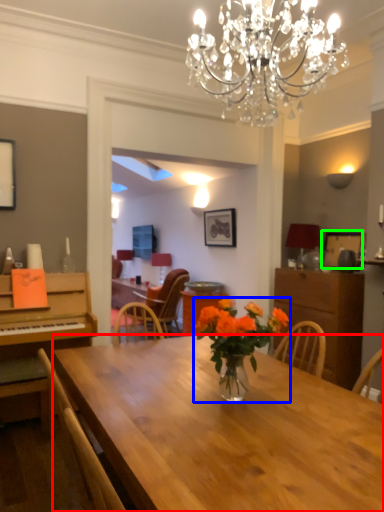
Question: Which object is positioned closest to desk (highlighted by a red box)? Select from houseplant (highlighted by a blue box) and picture frame (highlighted by a green box).

Choices:
 (A) houseplant
 (B) picture frame

Answer: (A)